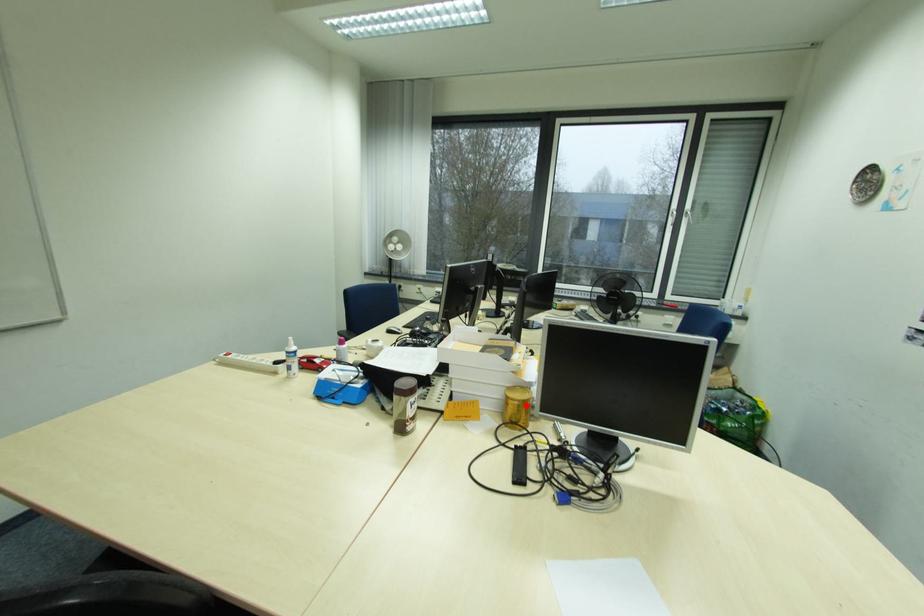
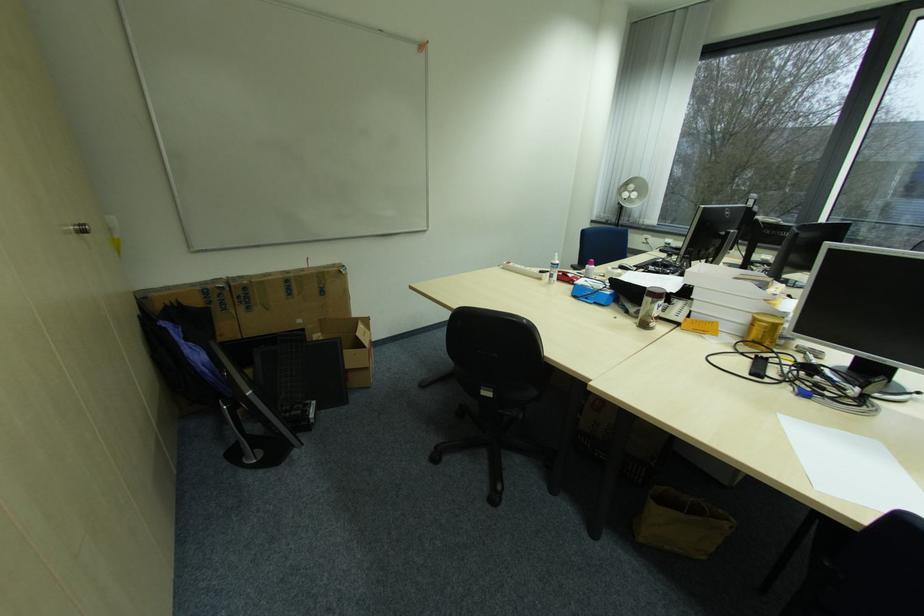
Find the pixel in the second image that matches the highlighted location in the first image.

(773, 329)